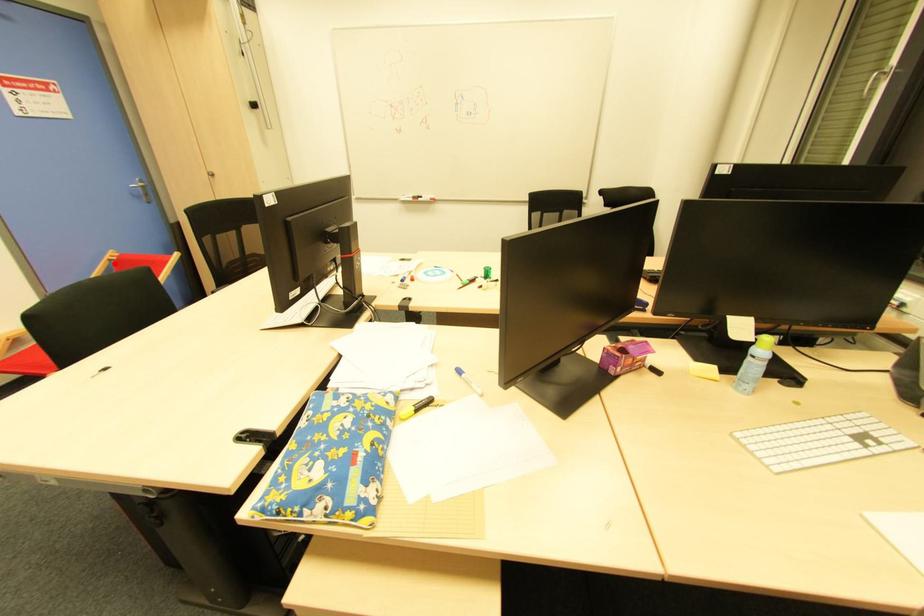
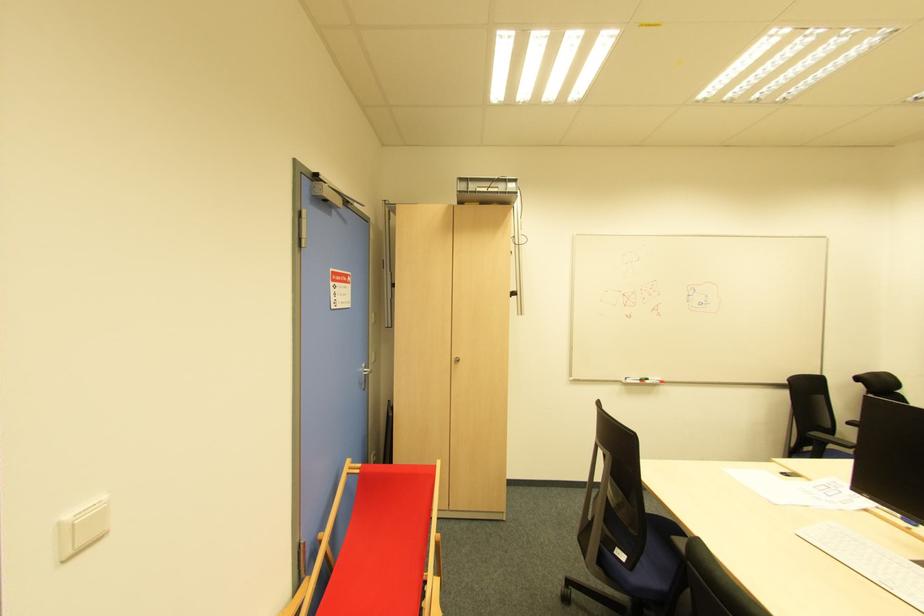
Question: I am providing you with two images of the same scene from different viewpoints. A red point is shown in image1. For the corresponding object point in image2, is it positioned nearer or farther from the camera?

Choices:
 (A) Nearer
 (B) Farther

Answer: (A)